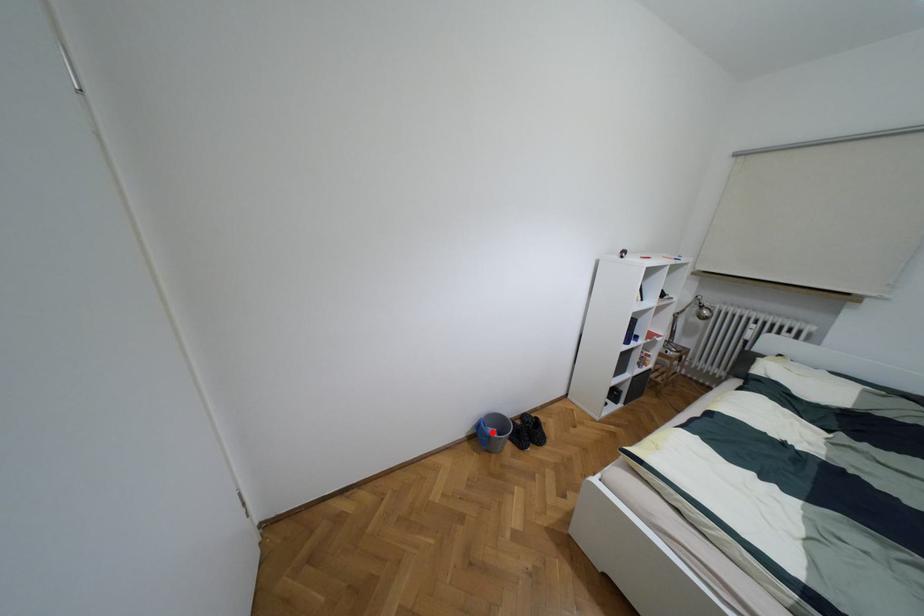
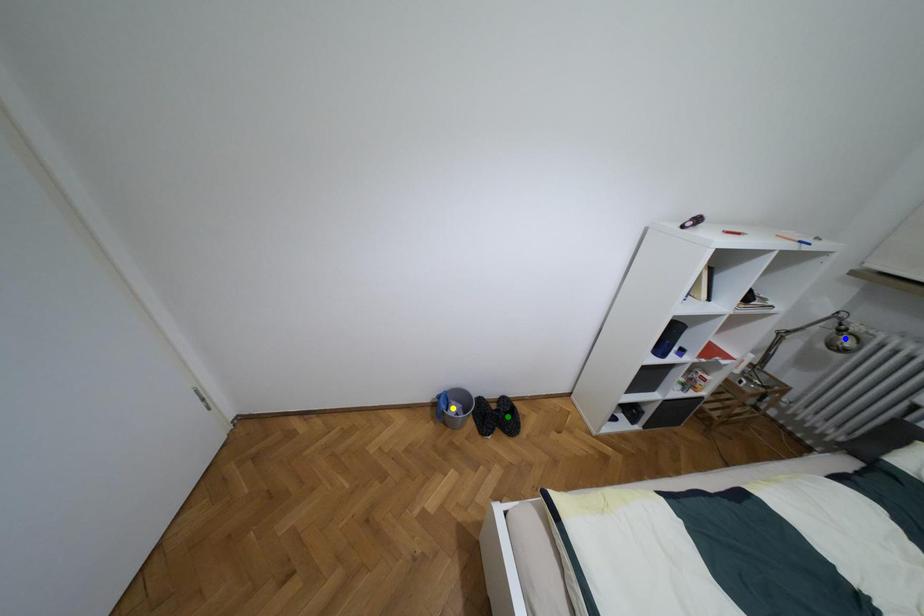
Question: I am providing you with two images of the same scene from different viewpoints. A red point is marked on the first image. You are given multiple points on the second image. Which spot in image 2 lines up with the point in image 1?

Choices:
 (A) yellow point
 (B) green point
 (C) blue point

Answer: (A)